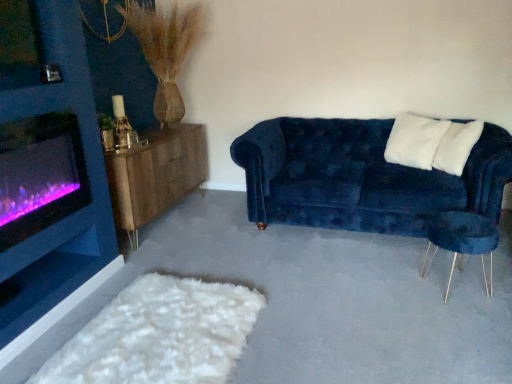
You are a GUI agent. You are given a task and a screenshot of the screen. Output one action in this format:
    pyautogui.click(x=<x>, y=<y>)
    Task: Click on the blank space to the left of velvet blue armchair at right
    The image size is (512, 384).
    Given the screenshot: What is the action you would take?
    pyautogui.click(x=399, y=283)